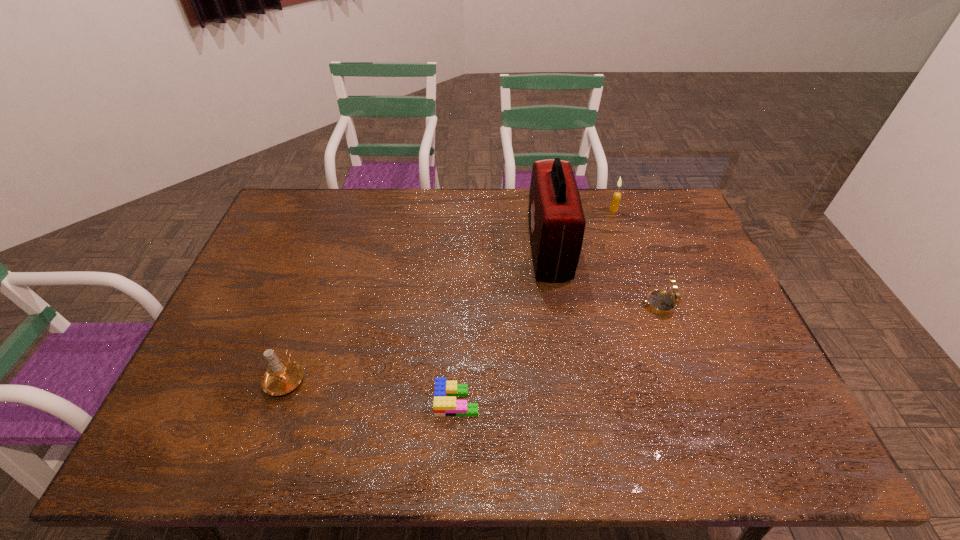
The height and width of the screenshot is (540, 960). I want to click on the first aid kit, so click(x=556, y=219).

This screenshot has height=540, width=960. I want to click on the second farthest object, so click(x=556, y=219).

Where is `the farther candle`? the farther candle is located at coordinates (617, 196).

Find the location of `the farthest object`. the farthest object is located at coordinates (617, 196).

The image size is (960, 540). In order to click on the left candle in this screenshot , I will do `click(281, 377)`.

Where is `the leftmost object`? The image size is (960, 540). the leftmost object is located at coordinates (281, 377).

The width and height of the screenshot is (960, 540). In order to click on the second shortest object in this screenshot , I will do `click(660, 302)`.

This screenshot has width=960, height=540. In order to click on the third nearest object in this screenshot , I will do `click(660, 302)`.

At what (x,y) coordinates should I click in order to perform the action: click on the shortest object. Please return your answer as a coordinate pair (x, y). Looking at the image, I should click on (445, 404).

You are a GUI agent. You are given a task and a screenshot of the screen. Output one action in this format:
    pyautogui.click(x=<x>, y=<y>)
    Task: Click on the Lego
    
    Given the screenshot: What is the action you would take?
    pyautogui.click(x=445, y=404)